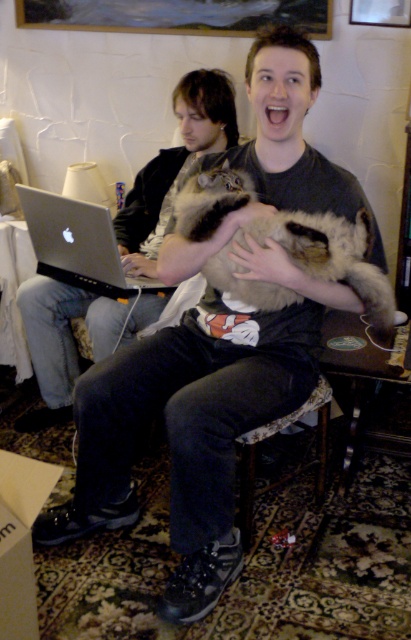
Which of these two, matte black laptop at left or fuzzy fur cat at center, stands taller?

Standing taller between the two is matte black laptop at left.

Is matte black laptop at left wider than fuzzy fur cat at center?

Yes.

What do you see at coordinates (73, 337) in the screenshot?
I see `matte black laptop at left` at bounding box center [73, 337].

Where is `matte black laptop at left`? This screenshot has width=411, height=640. matte black laptop at left is located at coordinates (73, 337).

Can you confirm if matte black laptop at left is thinner than silver metallic laptop at left?

No, matte black laptop at left is not thinner than silver metallic laptop at left.

Is matte black laptop at left bigger than silver metallic laptop at left?

Indeed, matte black laptop at left has a larger size compared to silver metallic laptop at left.

This screenshot has height=640, width=411. Identify the location of matte black laptop at left. point(73,337).

Can you confirm if fuzzy fur cat at center is positioned to the left of silver metallic laptop at left?

Incorrect, fuzzy fur cat at center is not on the left side of silver metallic laptop at left.

Is point (320, 257) behind point (157, 284)?

No.

The width and height of the screenshot is (411, 640). Find the location of `fuzzy fur cat at center`. fuzzy fur cat at center is located at coordinates click(330, 253).